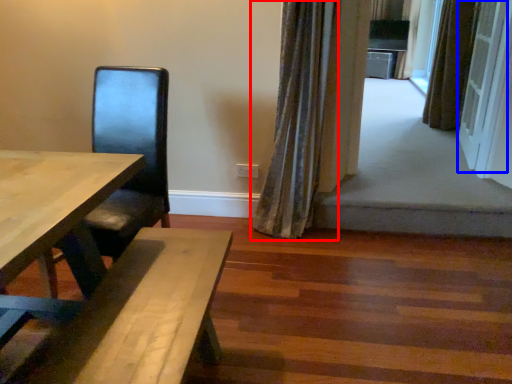
Question: Which object is further to the camera taking this photo, curtain (highlighted by a red box) or screen door (highlighted by a blue box)?

Choices:
 (A) curtain
 (B) screen door

Answer: (B)